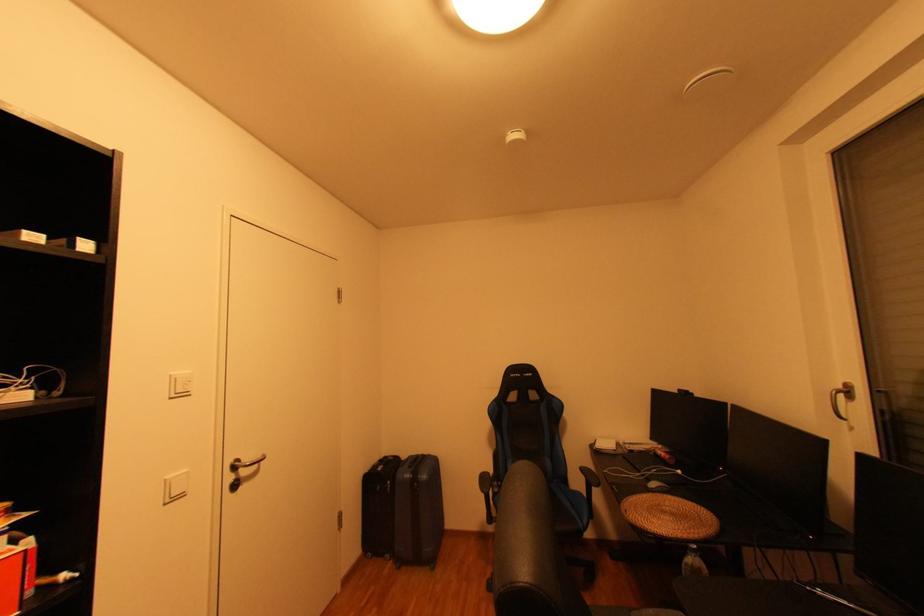
At what (x,y) coordinates should I click in order to perform the action: click on silver door handle. Please return your answer as a coordinate pair (x, y). Image resolution: width=924 pixels, height=616 pixels. Looking at the image, I should click on (246, 463).